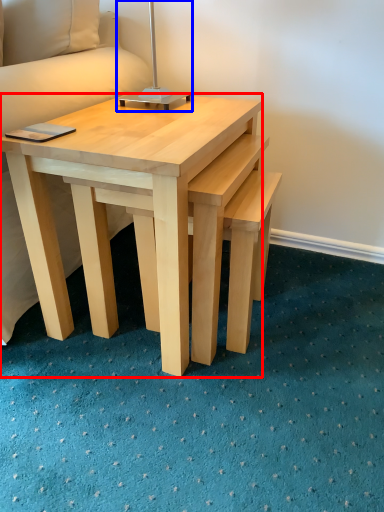
Question: Which object is further to the camera taking this photo, coffee table (highlighted by a red box) or bedside lamp (highlighted by a blue box)?

Choices:
 (A) coffee table
 (B) bedside lamp

Answer: (B)